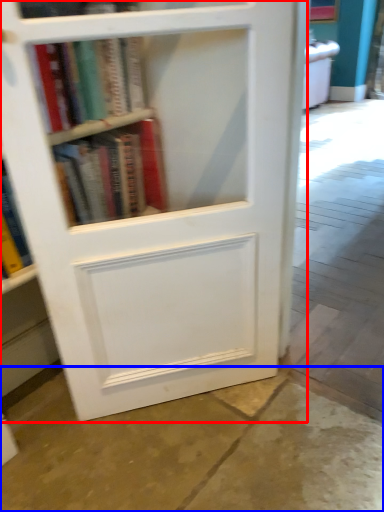
Question: Which of the following is the farthest to the observer, bookcase (highlighted by a red box) or concrete (highlighted by a blue box)?

Choices:
 (A) bookcase
 (B) concrete

Answer: (A)